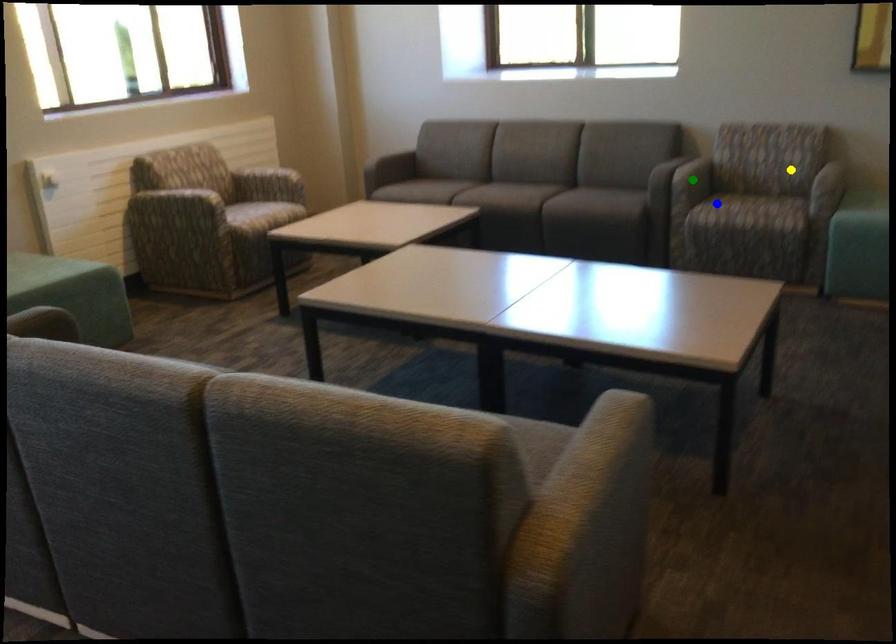
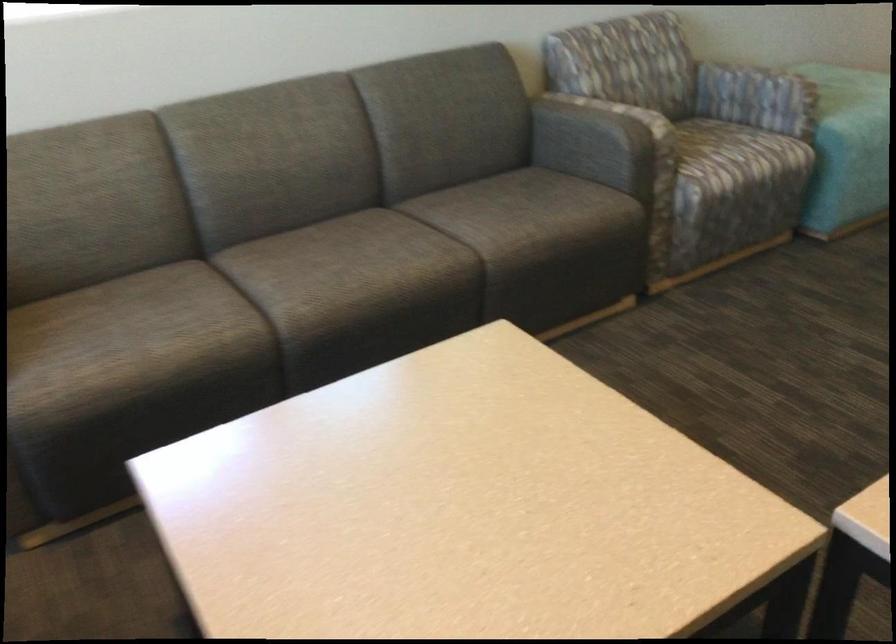
I am providing you with two images of the same scene from different viewpoints. Three points are marked in image1. Which point corresponds to a part or object that is occluded in image2?In image1, three points are marked. Which of them correspond to a part or object that is occluded in image2?Among the three points shown in image1, which one corresponds to a part or object that is no longer visible due to occlusion in image2?

green point cannot be seen in image2.